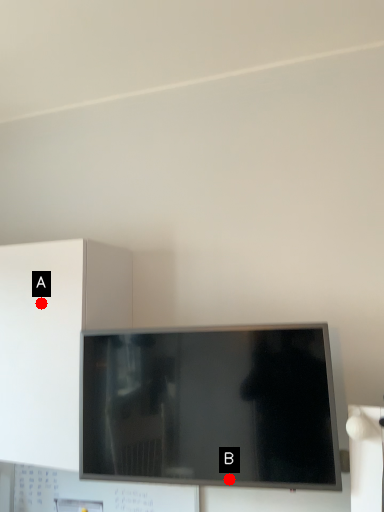
Question: Two points are circled on the image, labeled by A and B beside each circle. Which point is closer to the camera taking this photo?

Choices:
 (A) A is closer
 (B) B is closer

Answer: (B)